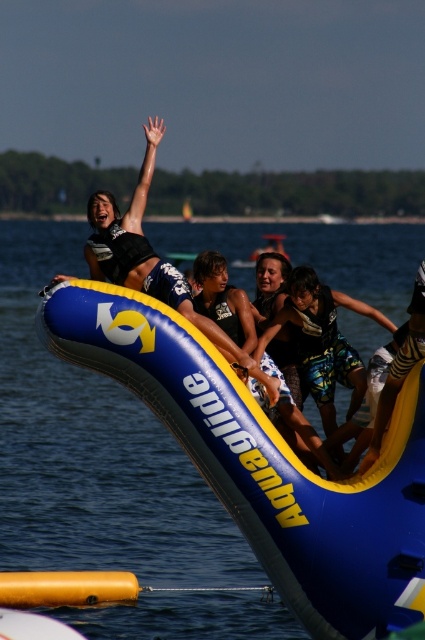
Does blue inflatable boat at center appear under blue and white wetsuit at center?

Indeed, blue inflatable boat at center is positioned under blue and white wetsuit at center.

From the picture: Which is more to the right, blue inflatable boat at center or blue and white wetsuit at center?

blue and white wetsuit at center is more to the right.

I want to click on blue inflatable boat at center, so click(x=266, y=464).